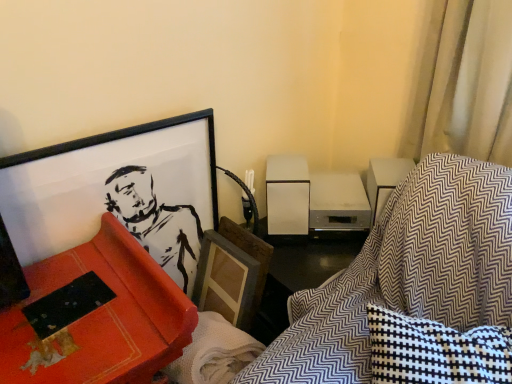
Question: From the image's perspective, is matte black picture frame at upper left on top of textured fabric swivel chair at lower right?

Choices:
 (A) yes
 (B) no

Answer: (A)

Question: Is the position of matte black picture frame at upper left more distant than that of textured fabric swivel chair at lower right?

Choices:
 (A) no
 (B) yes

Answer: (B)

Question: From the image's perspective, does matte black picture frame at upper left appear lower than textured fabric swivel chair at lower right?

Choices:
 (A) no
 (B) yes

Answer: (A)

Question: Is matte black picture frame at upper left to the left of textured fabric swivel chair at lower right from the viewer's perspective?

Choices:
 (A) yes
 (B) no

Answer: (A)

Question: Is matte black picture frame at upper left wider than textured fabric swivel chair at lower right?

Choices:
 (A) no
 (B) yes

Answer: (A)

Question: Considering the positions of textured fabric swivel chair at lower right and matte black picture frame at upper left in the image, is textured fabric swivel chair at lower right wider or thinner than matte black picture frame at upper left?

Choices:
 (A) wide
 (B) thin

Answer: (A)

Question: Is point (482, 286) closer or farther from the camera than point (31, 231)?

Choices:
 (A) closer
 (B) farther

Answer: (A)

Question: Which is correct: textured fabric swivel chair at lower right is inside matte black picture frame at upper left, or outside of it?

Choices:
 (A) outside
 (B) inside

Answer: (A)

Question: From the image's perspective, is textured fabric swivel chair at lower right above or below matte black picture frame at upper left?

Choices:
 (A) below
 (B) above

Answer: (A)

Question: From a real-world perspective, relative to textured fabric swivel chair at lower right, is matte red bookshelf at left vertically above or below?

Choices:
 (A) below
 (B) above

Answer: (A)

Question: Considering the positions of matte red bookshelf at left and textured fabric swivel chair at lower right in the image, is matte red bookshelf at left taller or shorter than textured fabric swivel chair at lower right?

Choices:
 (A) tall
 (B) short

Answer: (A)

Question: From the image's perspective, is matte red bookshelf at left positioned above or below textured fabric swivel chair at lower right?

Choices:
 (A) above
 (B) below

Answer: (B)

Question: Based on their sizes in the image, would you say matte red bookshelf at left is bigger or smaller than textured fabric swivel chair at lower right?

Choices:
 (A) small
 (B) big

Answer: (B)

Question: Considering the positions of matte red bookshelf at left and matte black picture frame at upper left in the image, is matte red bookshelf at left wider or thinner than matte black picture frame at upper left?

Choices:
 (A) wide
 (B) thin

Answer: (A)

Question: Is matte red bookshelf at left to the left or to the right of matte black picture frame at upper left in the image?

Choices:
 (A) left
 (B) right

Answer: (A)